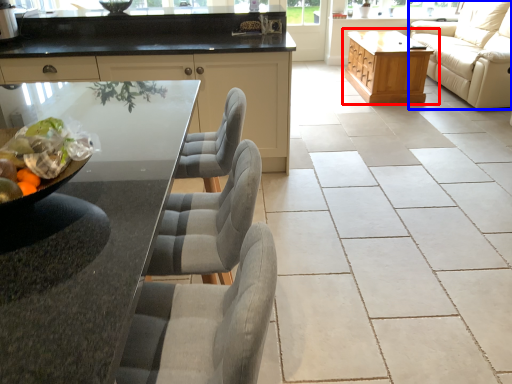
Question: Which object is closer to the camera taking this photo, table (highlighted by a red box) or studio couch (highlighted by a blue box)?

Choices:
 (A) table
 (B) studio couch

Answer: (B)